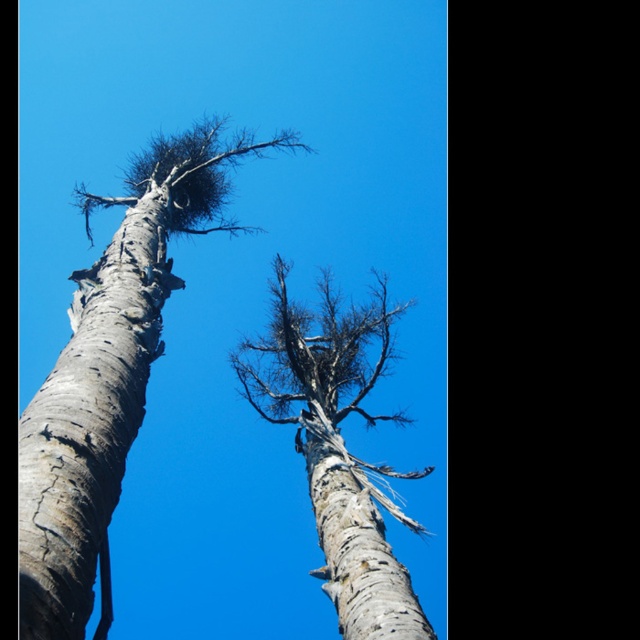
You are an arborist assessing two trees in a park. You notice the gray textured bark at left and the gray bark birch tree at center. Which tree has a wider trunk?

The gray bark birch tree at center has a wider trunk than the gray textured bark at left, as the gray textured bark at left is narrower.

You are standing at the point marked as point (108,376) in the image. Looking towards the gray textured bark birch tree at left, which direction should you face to see the tree?

The gray textured bark birch tree at left is located at point (108,376), so you are already at the tree. Therefore, you don not need to face any direction to see it.